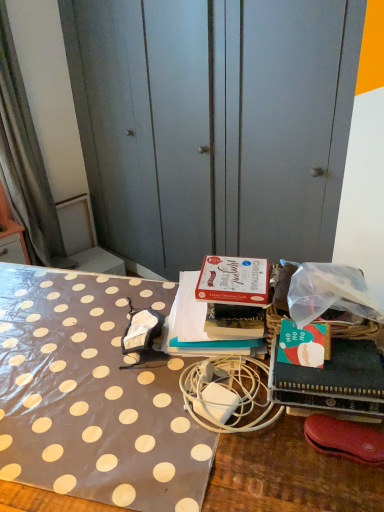
Locate an element on the screen. This screenshot has width=384, height=512. free spot in front of matte cardboard box at center, the 1th book in the back-to-front sequence is located at coordinates (163, 418).